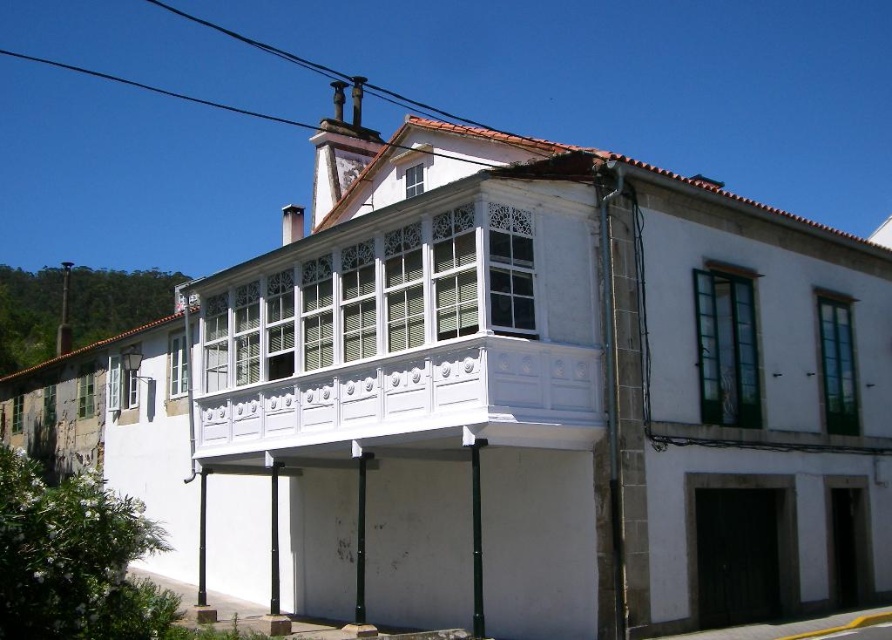
Question: Can you confirm if white wood balcony at upper center is positioned to the right of black wire at upper center?

Choices:
 (A) no
 (B) yes

Answer: (B)

Question: Is white wood balcony at upper center to the right of black wire at upper center from the viewer's perspective?

Choices:
 (A) yes
 (B) no

Answer: (A)

Question: Can you confirm if white wood balcony at upper center is positioned below black wire at upper center?

Choices:
 (A) no
 (B) yes

Answer: (B)

Question: Among these objects, which one is farthest from the camera?

Choices:
 (A) black wire at upper center
 (B) white wood balcony at upper center

Answer: (A)